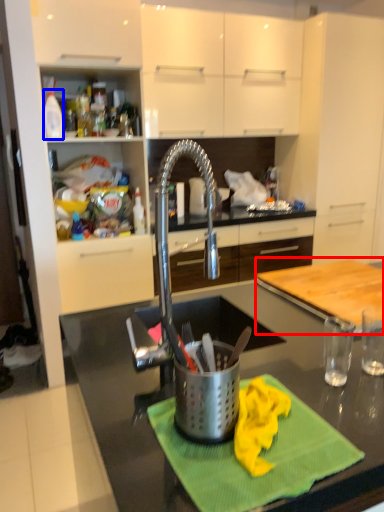
Question: Which point is further to the camera, counter (highlighted by a red box) or kitchen appliance (highlighted by a blue box)?

Choices:
 (A) counter
 (B) kitchen appliance

Answer: (B)